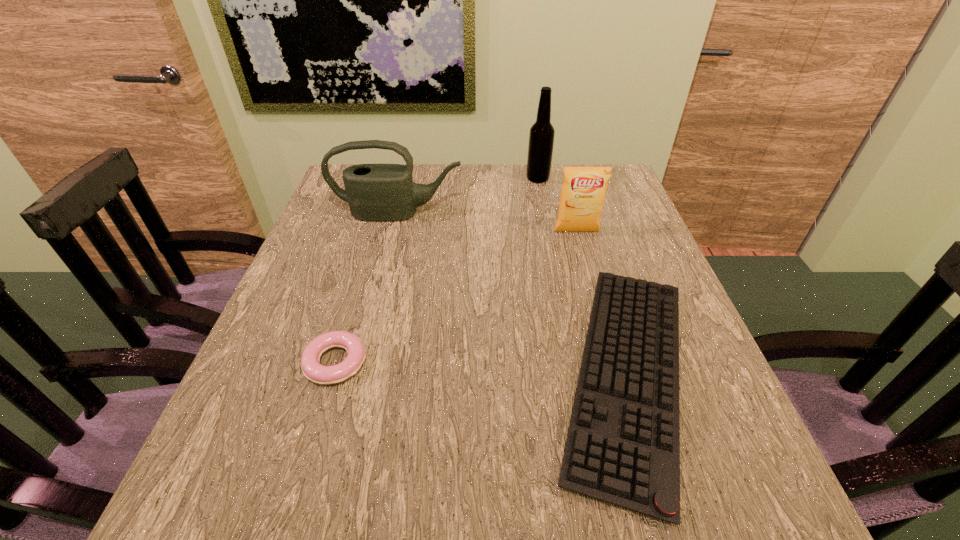
Image resolution: width=960 pixels, height=540 pixels. Find the location of `free location that satisfies the following two spatial constraints: 1. on the spout of the computer keyboard; 2. on the left side of the second farthest object`. free location that satisfies the following two spatial constraints: 1. on the spout of the computer keyboard; 2. on the left side of the second farthest object is located at coordinates (358, 374).